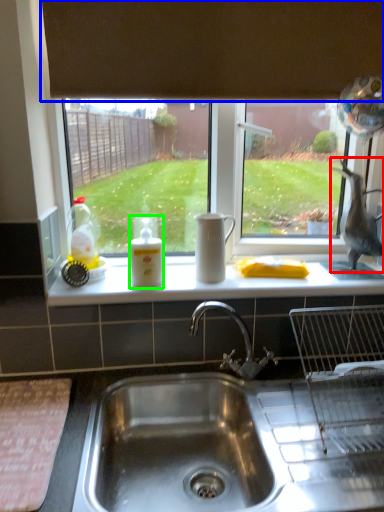
Question: Estimate the real-world distances between objects in this image. Which object is closer to animal (highlighted by a red box), exhaust hood (highlighted by a blue box) or bottle (highlighted by a green box)?

Choices:
 (A) exhaust hood
 (B) bottle

Answer: (A)